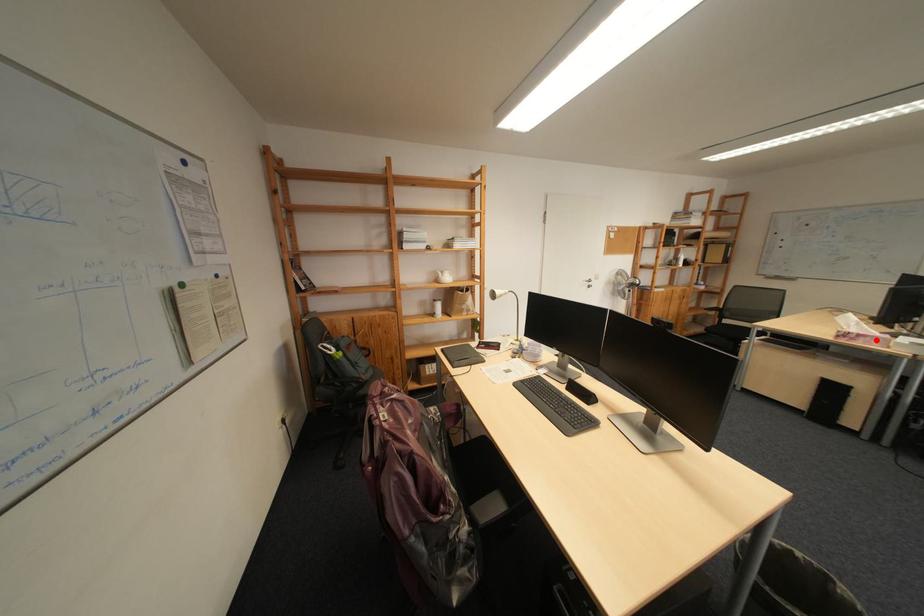
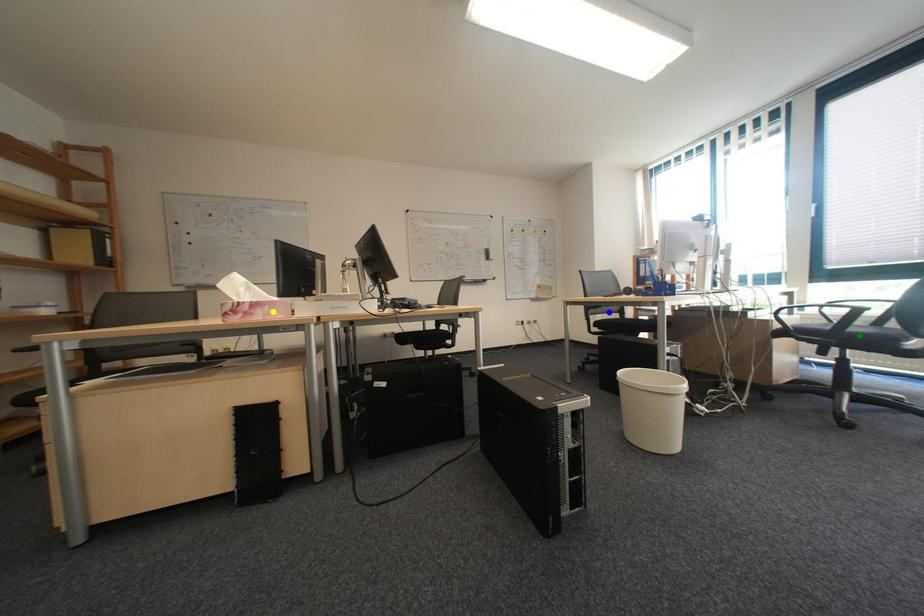
Question: I am providing you with two images of the same scene from different viewpoints. A red point is marked on the first image. You are given multiple points on the second image. Which point in image 2 is actually the same real-world point as the red point in image 1?

Choices:
 (A) green point
 (B) blue point
 (C) yellow point

Answer: (C)